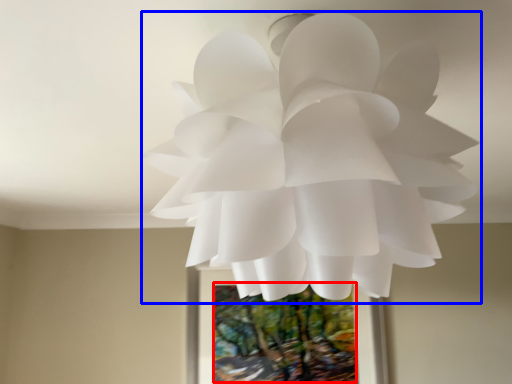
Question: Which object is further to the camera taking this photo, tree (highlighted by a red box) or flower (highlighted by a blue box)?

Choices:
 (A) tree
 (B) flower

Answer: (A)